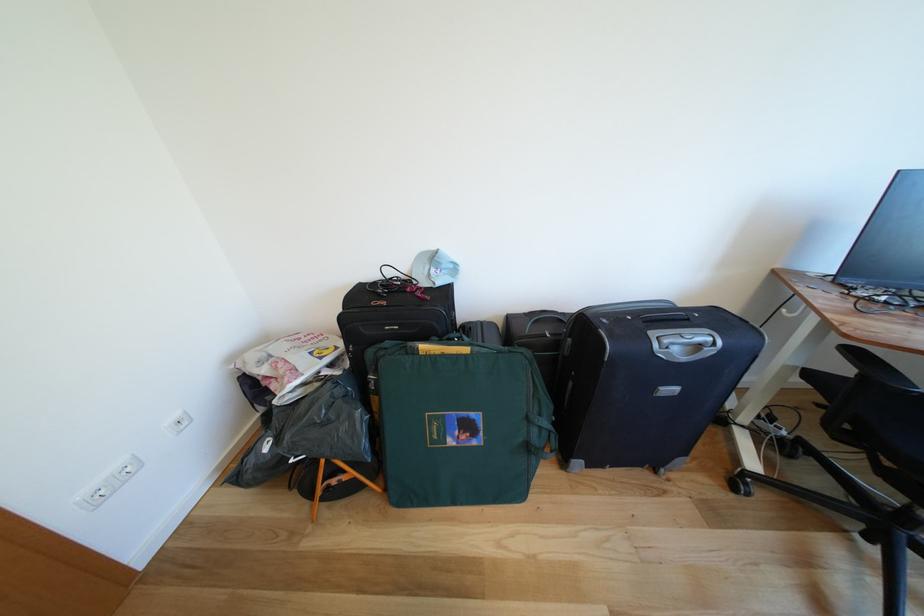
This screenshot has height=616, width=924. What do you see at coordinates (687, 344) in the screenshot?
I see `a gray suitcase handle` at bounding box center [687, 344].